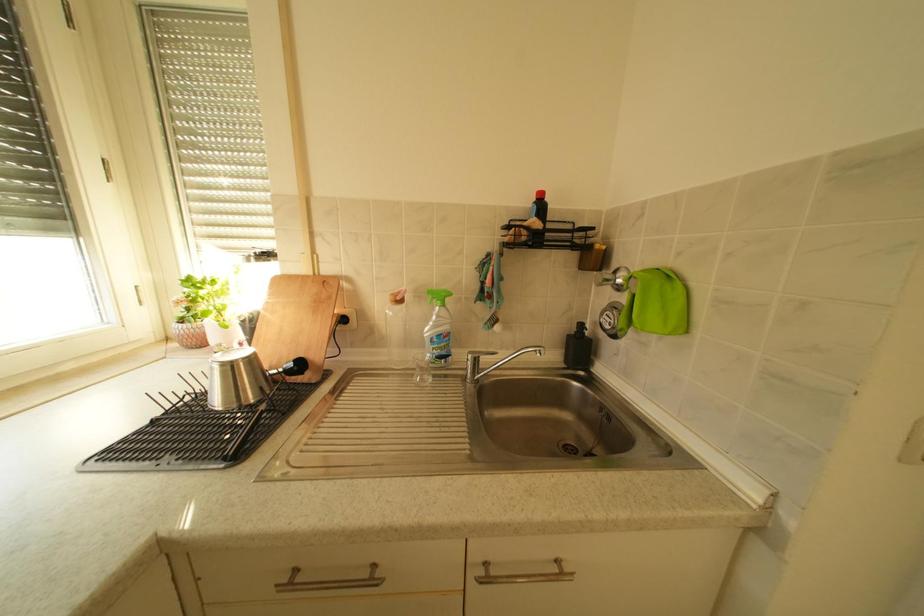
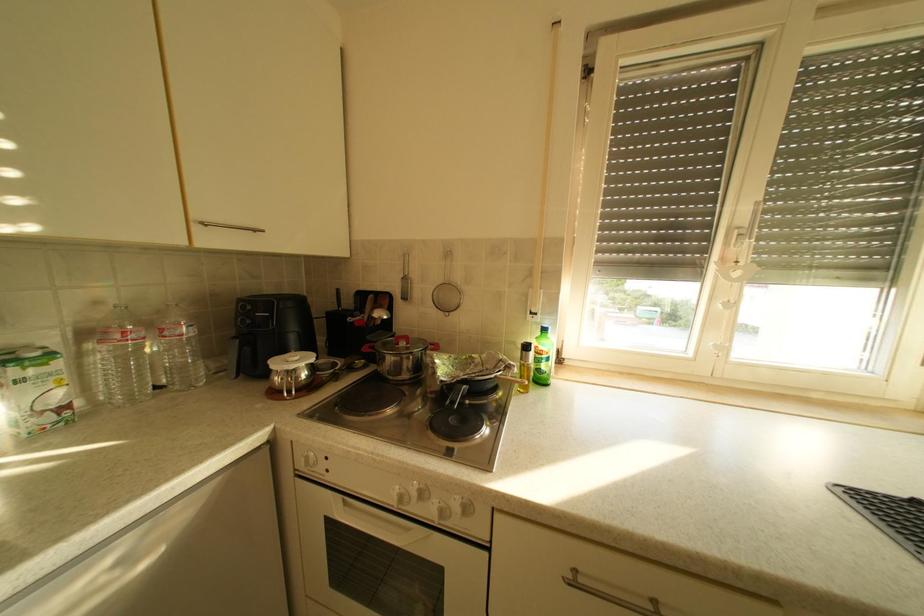
Question: The first image is from the beginning of the video and the second image is from the end. How did the camera likely rotate when shooting the video?

Choices:
 (A) Left
 (B) Right
 (C) Up
 (D) Down

Answer: (A)